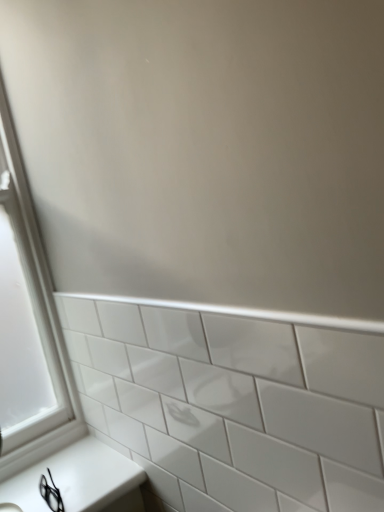
The image size is (384, 512). Describe the element at coordinates (76, 478) in the screenshot. I see `white glossy counter top at lower left` at that location.

Measure the distance between white glossy counter top at lower left and camera.

37.89 inches.

This screenshot has height=512, width=384. What are the coordinates of `white glossy counter top at lower left` in the screenshot? It's located at (76, 478).

I want to click on white glossy counter top at lower left, so click(76, 478).